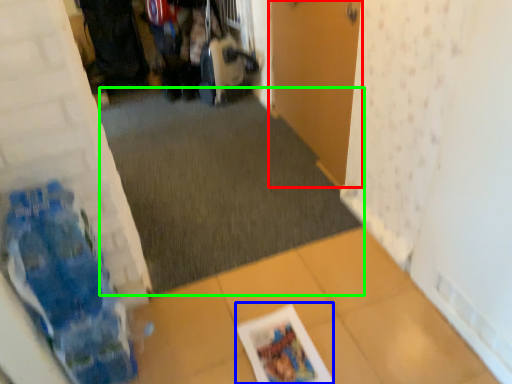
Question: Which is farther away from door (highlighted by a red box)? magazine (highlighted by a blue box) or plain (highlighted by a green box)?

Choices:
 (A) magazine
 (B) plain

Answer: (A)